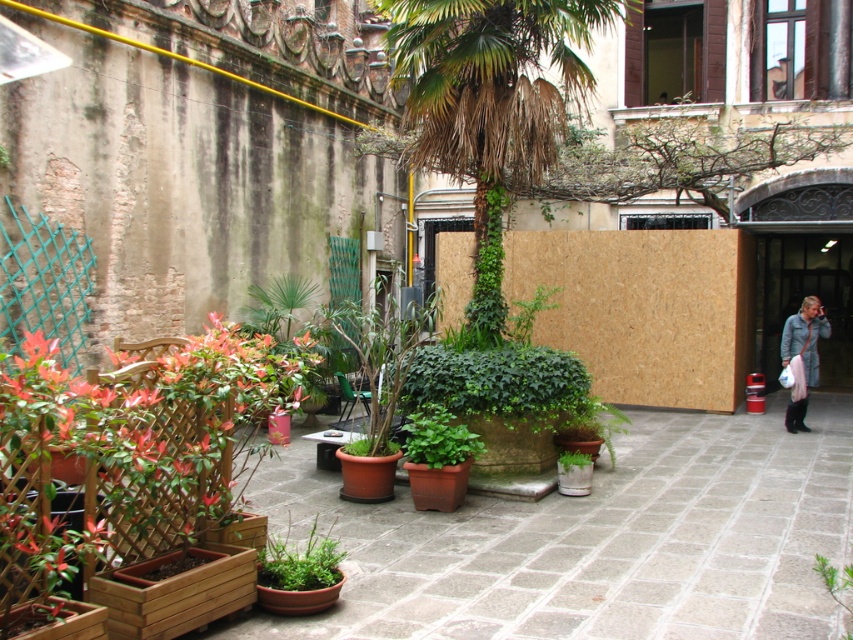
Between green leafy palm tree at center and light gray fabric coat at right, which one is positioned lower?

light gray fabric coat at right

Is green leafy palm tree at center closer to the viewer compared to light gray fabric coat at right?

Yes, green leafy palm tree at center is in front of light gray fabric coat at right.

Is point (514, 58) behind point (793, 337)?

No, it is in front of (793, 337).

This screenshot has height=640, width=853. What are the coordinates of `green leafy palm tree at center` in the screenshot? It's located at tap(490, 108).

Who is taller, green leafy palm tree at center or green matte plant at center?

With more height is green leafy palm tree at center.

Which is below, green leafy palm tree at center or green matte plant at center?

green matte plant at center

Who is more forward, (550, 122) or (280, 572)?

Point (280, 572) is in front.

You are a GUI agent. You are given a task and a screenshot of the screen. Output one action in this format:
    pyautogui.click(x=<x>, y=<y>)
    Task: Click on the green leafy palm tree at center
    
    Given the screenshot: What is the action you would take?
    pyautogui.click(x=490, y=108)

Between green matte plant at center and light gray fabric coat at right, which one has less height?

With less height is green matte plant at center.

Is green matte plant at center closer to the viewer compared to light gray fabric coat at right?

Yes, it is.

The width and height of the screenshot is (853, 640). Describe the element at coordinates (300, 563) in the screenshot. I see `green matte plant at center` at that location.

At what (x,y) coordinates should I click in order to perform the action: click on green matte plant at center. Please return your answer as a coordinate pair (x, y). Looking at the image, I should click on (300, 563).